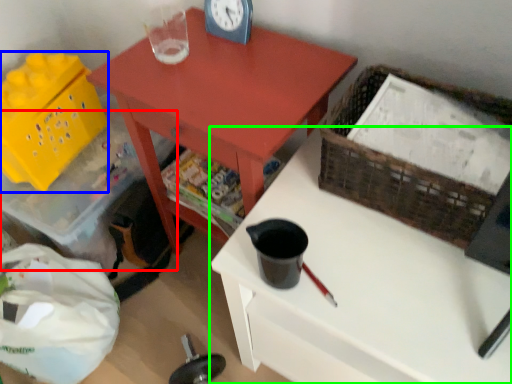
Question: Based on their relative distances, which object is nearer to storage box (highlighted by a red box)? Choose from basket (highlighted by a blue box) and desk (highlighted by a green box).

Choices:
 (A) basket
 (B) desk

Answer: (A)